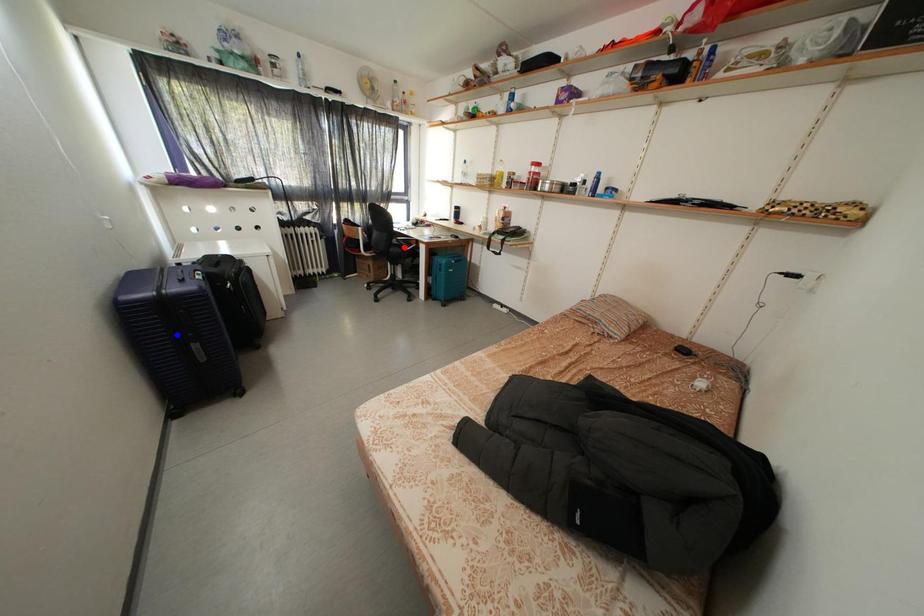
Question: Which of the two points in the image is closer to the camera?

Choices:
 (A) Blue point is closer.
 (B) Red point is closer.

Answer: (A)